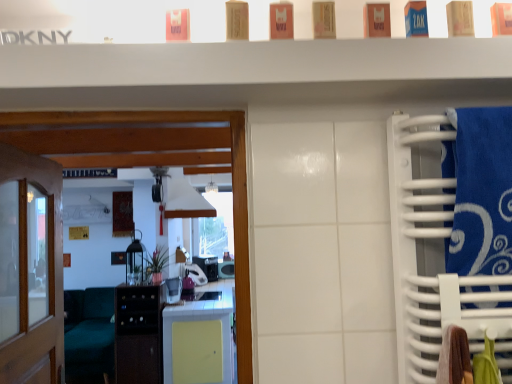
Question: Is matte black lantern at center, which ranks as the fourth appliance in back-to-front order, wider or thinner than purple plastic toaster at center, which is the third appliance from back to front?

Choices:
 (A) thin
 (B) wide

Answer: (A)

Question: Considering the positions of matte black lantern at center, which ranks as the fourth appliance in back-to-front order, and purple plastic toaster at center, which is the third appliance from back to front, in the image, is matte black lantern at center, which ranks as the fourth appliance in back-to-front order, taller or shorter than purple plastic toaster at center, which is the third appliance from back to front,?

Choices:
 (A) tall
 (B) short

Answer: (A)

Question: Estimate the real-world distances between objects in this image. Which object is closer to the white glossy microwave at center, the first appliance when ordered from front to back?

Choices:
 (A) white matte exhaust hood at center
 (B) teal fabric couch at lower left
 (C) black plastic microwave at center, which appears as the first appliance when viewed from the back
 (D) transparent glass door at left
 (E) blue fabric towel at right

Answer: (C)

Question: Which object is positioned closest to the black plastic microwave at center, the 5th appliance in the front-to-back sequence?

Choices:
 (A) matte black lantern at center, the second appliance in the front-to-back sequence
 (B) purple plastic toaster at center, which ranks as the third appliance in front-to-back order
 (C) blue fabric towel at right
 (D) transparent glass door at left
 (E) white glossy microwave at center, the first appliance when ordered from front to back

Answer: (B)